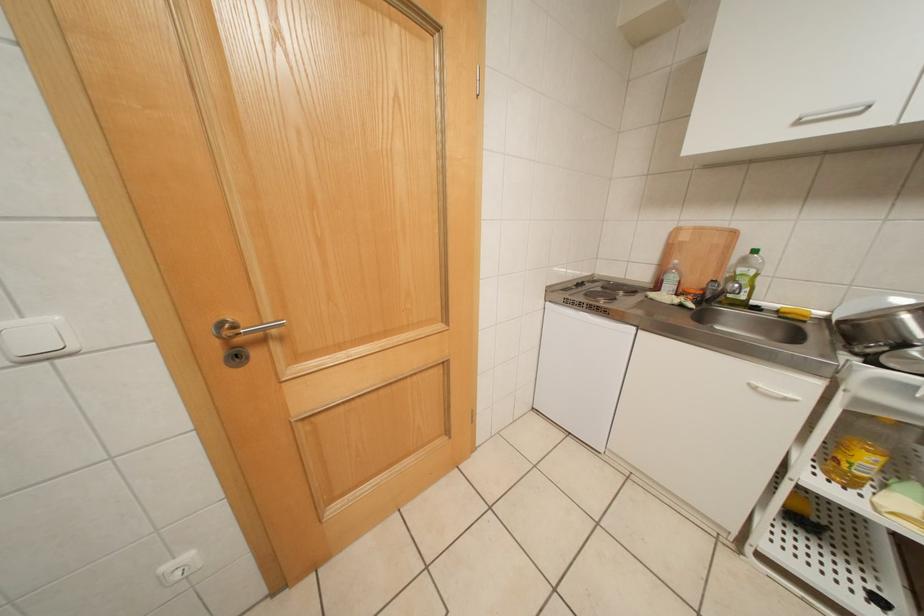
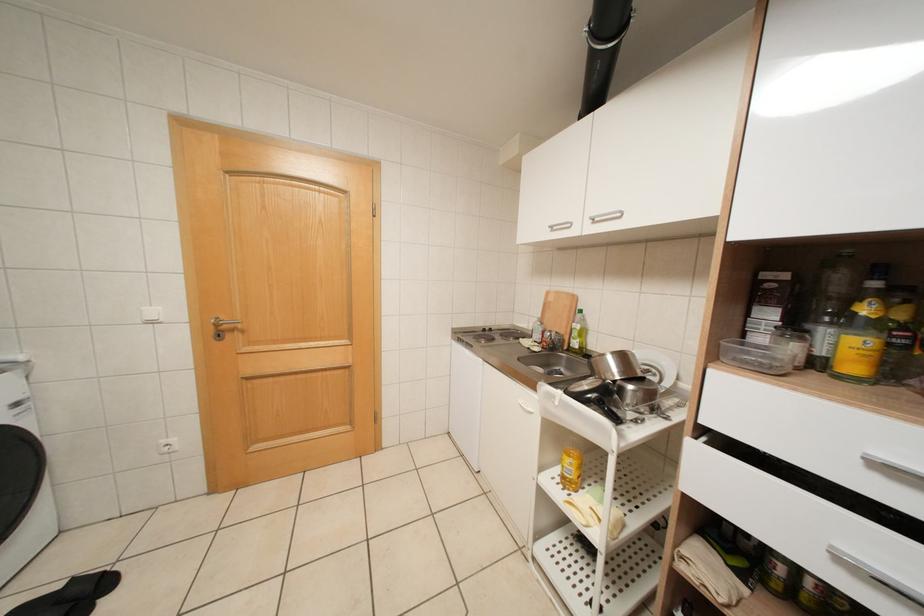
In a continuous first-person perspective shot, in which direction is the camera moving?

The movement direction of the cameraman is right, backward.